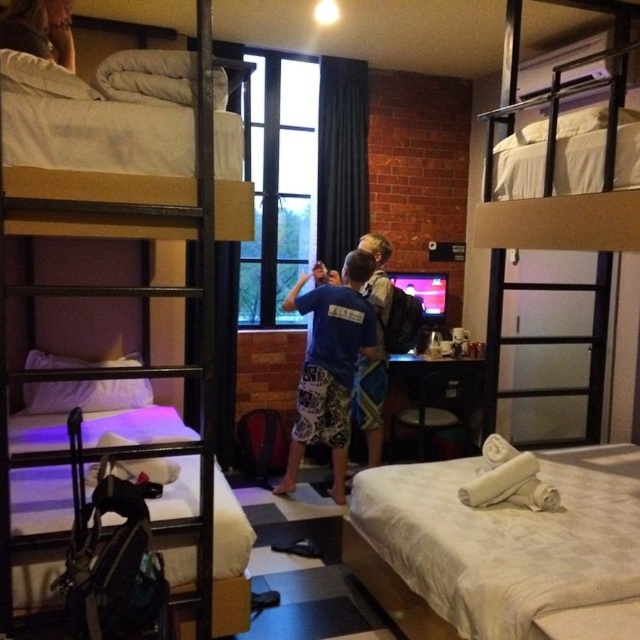
Question: Can you confirm if white textured bed at lower right is positioned below blue printed shorts at center?

Choices:
 (A) no
 (B) yes

Answer: (B)

Question: Is white textured bed at lower right to the right of metallic silver bunk bed at left from the viewer's perspective?

Choices:
 (A) no
 (B) yes

Answer: (B)

Question: Which object is the closest to the blue printed shorts at center?

Choices:
 (A) blue cotton shirt at center
 (B) white textured bed at lower right
 (C) smooth skin face at upper left
 (D) metallic silver bunk bed at left

Answer: (A)

Question: Is metallic silver bunk bed at left below smooth skin face at upper left?

Choices:
 (A) yes
 (B) no

Answer: (A)

Question: Which point is farther to the camera?

Choices:
 (A) blue printed shorts at center
 (B) white textured bed at lower right
 (C) metallic silver bunk bed at left

Answer: (A)

Question: Which of the following is the farthest from the observer?

Choices:
 (A) (381, 392)
 (B) (116, 221)
 (C) (310, 352)

Answer: (A)